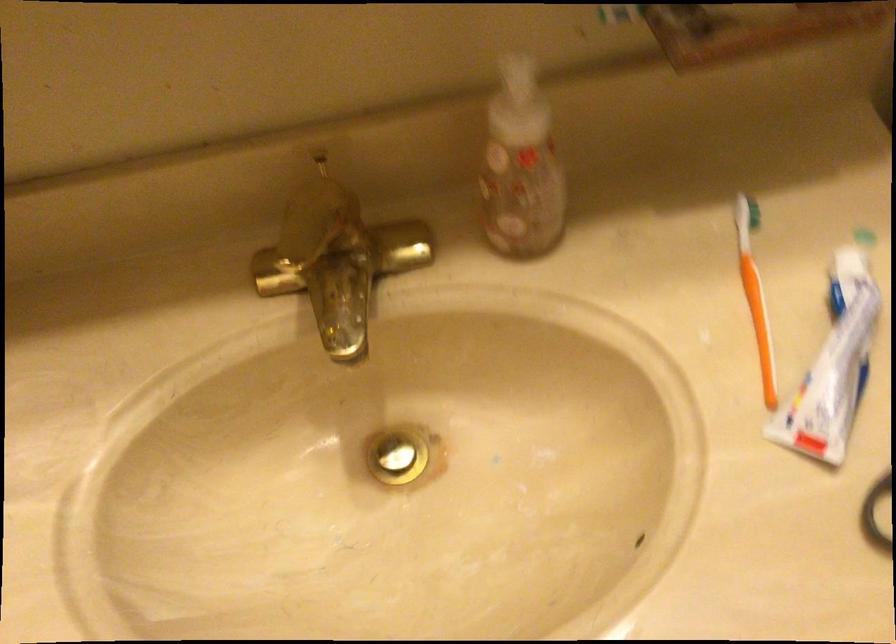
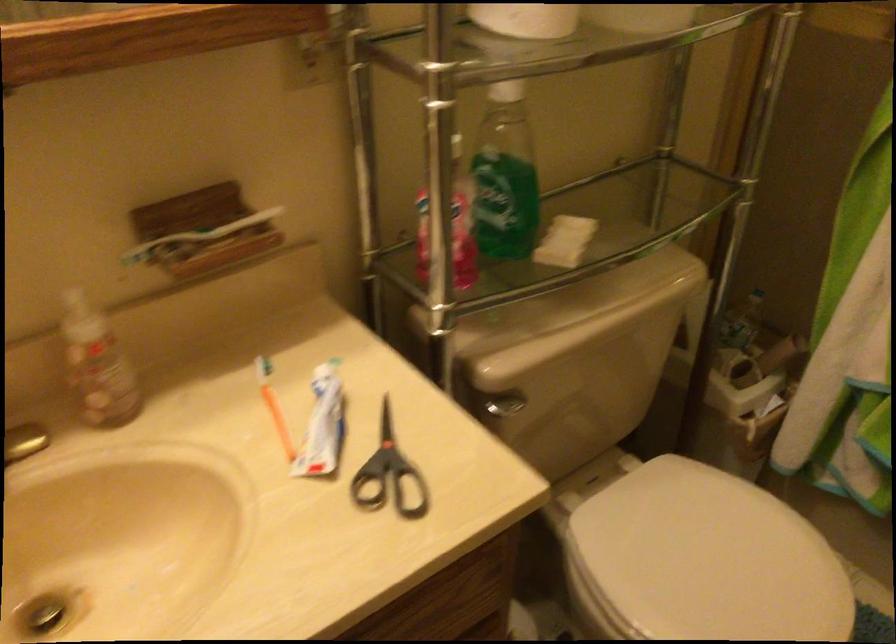
Locate, in the second image, the point that corresponds to (824,363) in the first image.

(323, 424)